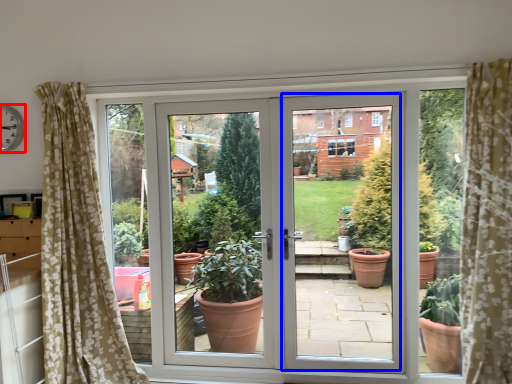
Question: Which object is closer to the camera taking this photo, clock (highlighted by a red box) or screen door (highlighted by a blue box)?

Choices:
 (A) clock
 (B) screen door

Answer: (B)